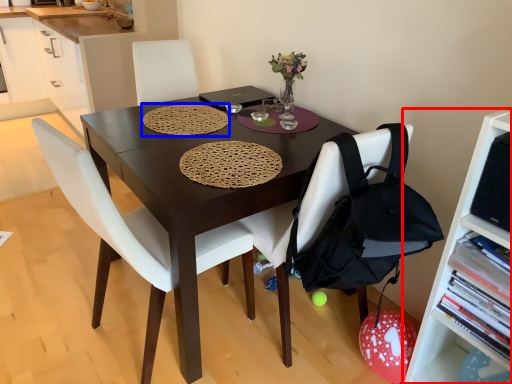
Question: Which object appears farthest to the camera in this image, shelf (highlighted by a red box) or mat (highlighted by a blue box)?

Choices:
 (A) shelf
 (B) mat

Answer: (B)